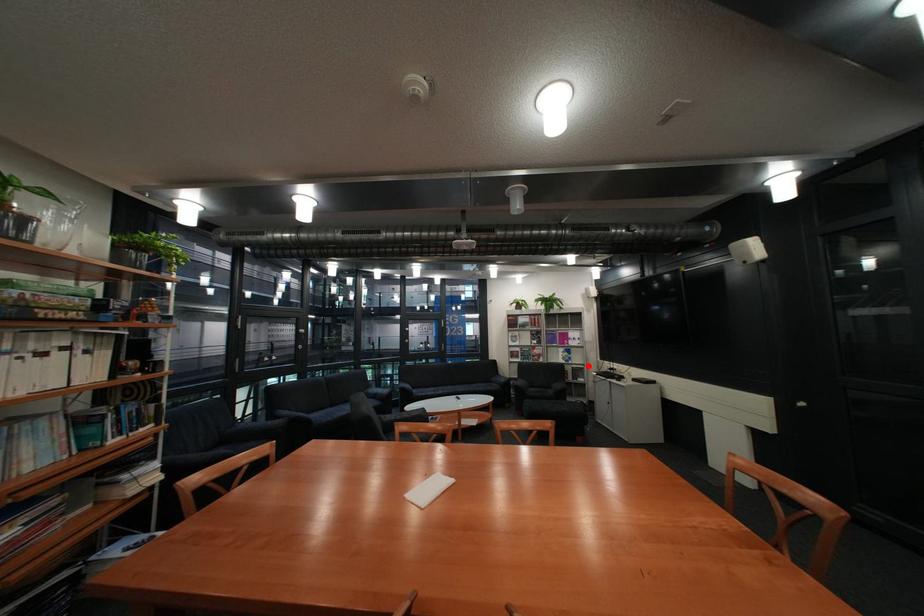
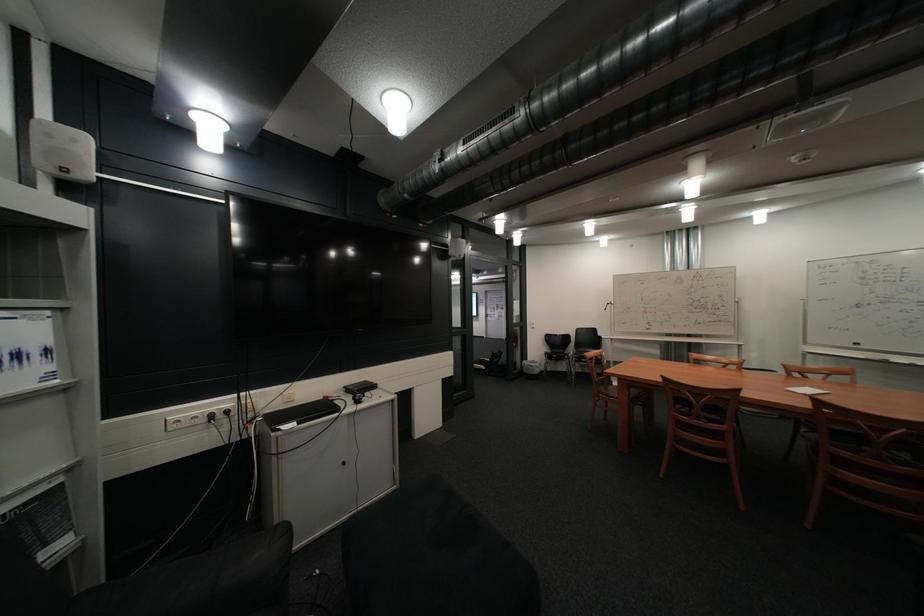
Question: I am providing you with two images of the same scene from different viewpoints. Given a red point in image1, look at the same physical point in image2. Is it:

Choices:
 (A) Closer to the viewpoint
 (B) Farther from the viewpoint

Answer: (A)